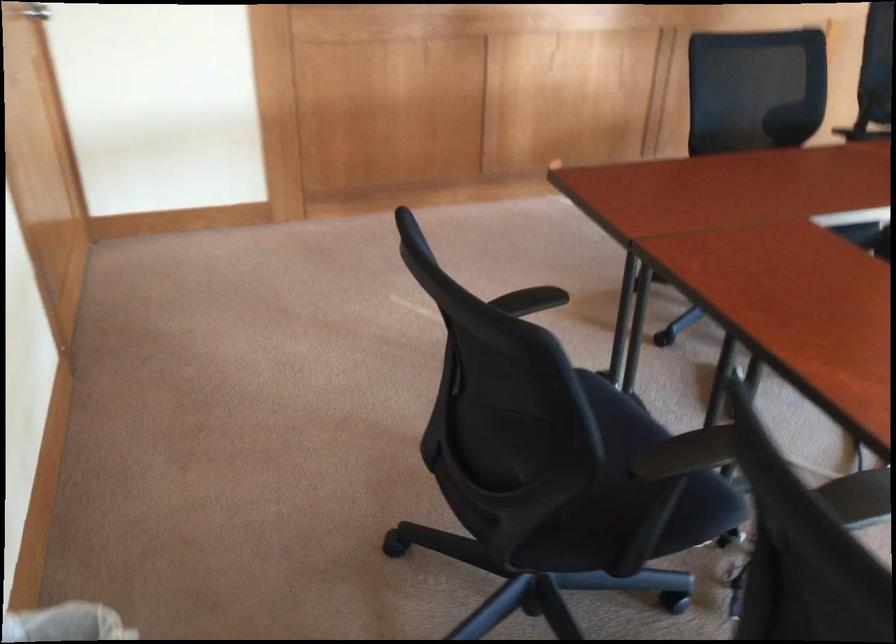
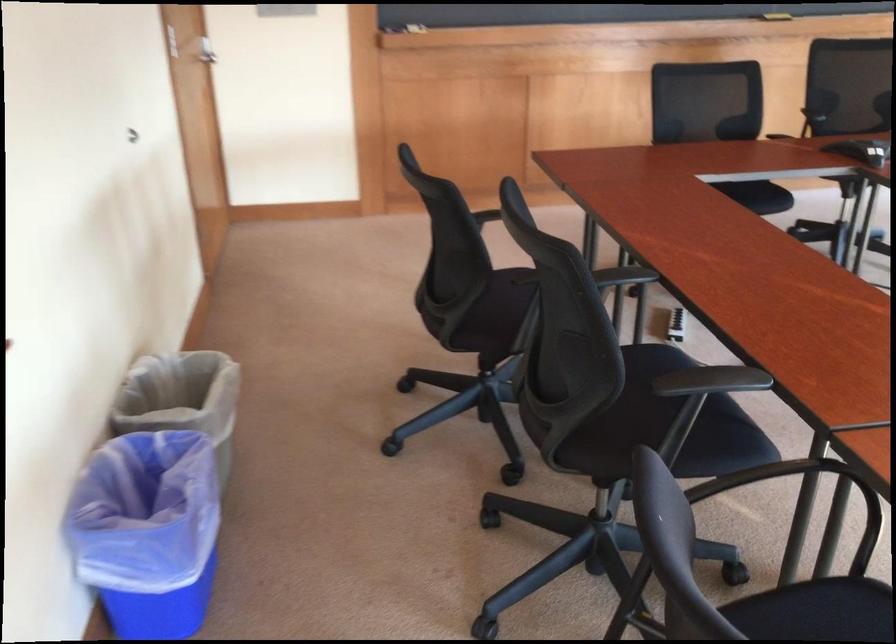
The point at (x=573, y=491) is marked in the first image. Where is the corresponding point in the second image?

(497, 313)